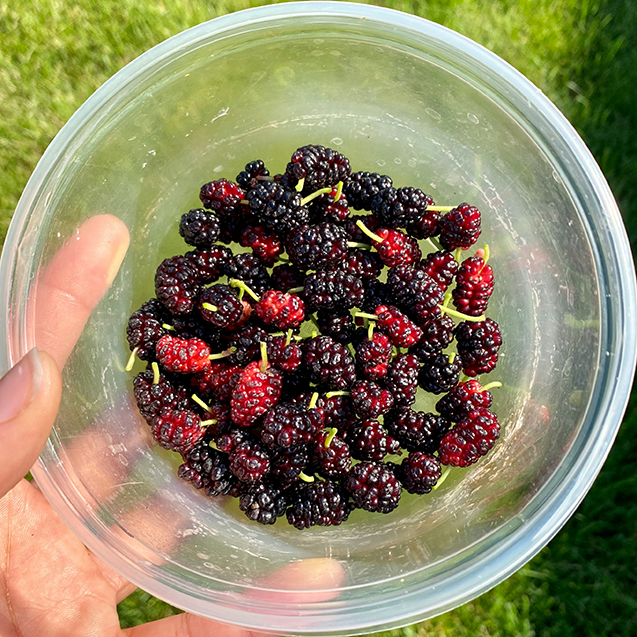
Identify the location of plastic bowl. (475, 122).